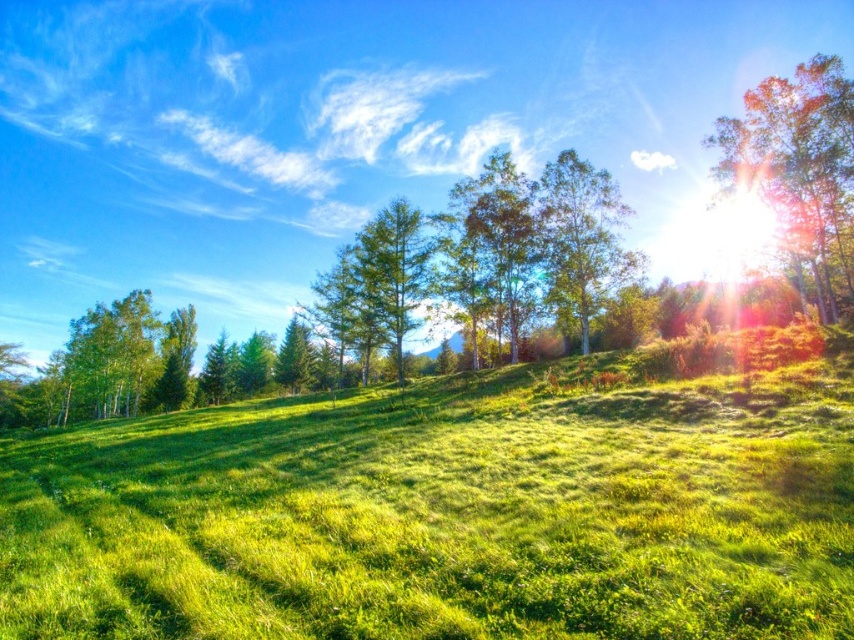
Question: Estimate the real-world distances between objects in this image. Which object is closer to the green leafy tree at upper right?

Choices:
 (A) green soft grass at center
 (B) green leafy tree at center

Answer: (B)

Question: Is green soft grass at center to the right of green leafy tree at center from the viewer's perspective?

Choices:
 (A) no
 (B) yes

Answer: (A)

Question: Which point is closer to the camera?

Choices:
 (A) green leafy tree at center
 (B) green soft grass at center

Answer: (B)

Question: Can you confirm if green soft grass at center is positioned above green leafy tree at center?

Choices:
 (A) no
 (B) yes

Answer: (A)

Question: Can you confirm if green soft grass at center is positioned below green leafy tree at upper right?

Choices:
 (A) yes
 (B) no

Answer: (A)

Question: Estimate the real-world distances between objects in this image. Which object is farther from the green leafy tree at upper right?

Choices:
 (A) green soft grass at center
 (B) green leafy tree at center

Answer: (A)